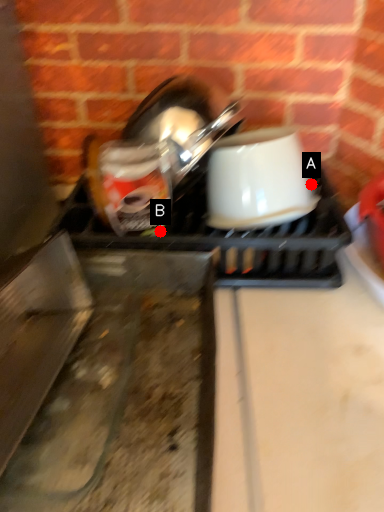
Question: Two points are circled on the image, labeled by A and B beside each circle. Which point is closer to the camera?

Choices:
 (A) A is closer
 (B) B is closer

Answer: (B)